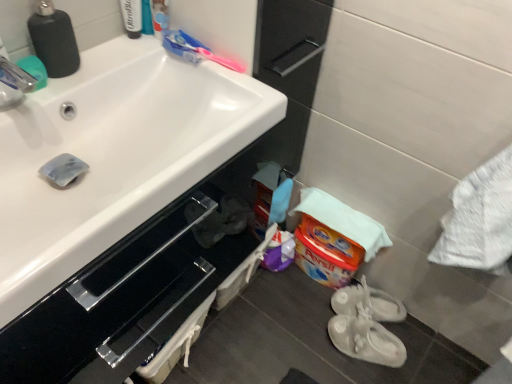
I want to click on vacant position to the left of white rubber shoes at lower right, positioned as the 1th footwear in back-to-front order, so click(x=305, y=313).